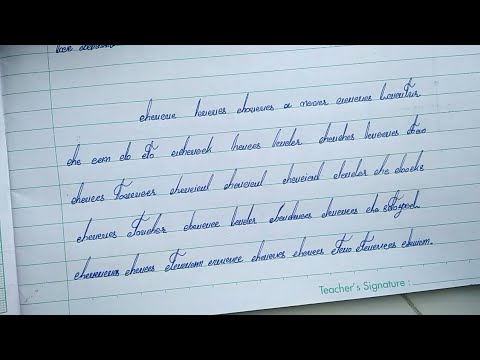
The image size is (480, 360). I want to click on tile, so click(x=390, y=298), click(x=444, y=303).